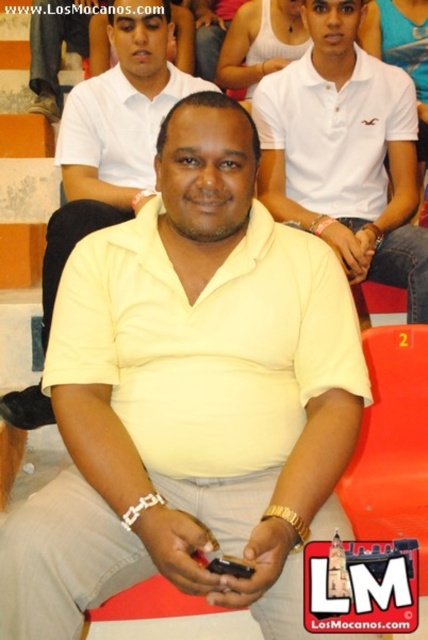
Question: Is yellow matte shirt at center positioned at the back of matte black shoe at upper left?

Choices:
 (A) yes
 (B) no

Answer: (B)

Question: Among these points, which one is nearest to the camera?

Choices:
 (A) (371, 138)
 (B) (64, 212)
 (C) (41, 76)

Answer: (B)

Question: Is white matte polo shirt at center thinner than yellow matte shirt at center?

Choices:
 (A) yes
 (B) no

Answer: (A)

Question: Which object is positioned closest to the yellow matte shirt at center?

Choices:
 (A) white matte polo shirt at center
 (B) matte black shoe at upper left

Answer: (A)

Question: Is white matte polo shirt at center bigger than matte black shoe at upper left?

Choices:
 (A) yes
 (B) no

Answer: (A)

Question: Which point is farther from the camera taking this photo?

Choices:
 (A) (410, 294)
 (B) (53, 45)
 (C) (115, 20)

Answer: (B)